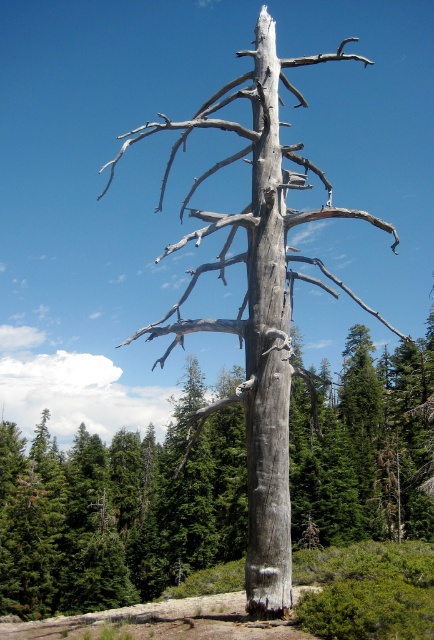
You are an artist trying to sketch the scene. You want to place the gray textured trunk at center in your drawing. Where should you position it on your canvas using the coordinate system provided?

You should position the gray textured trunk at center at the coordinate point of (118, 509) on your canvas.

Based on the photo, you are a hiker trying to identify landmarks in the forest. You see the gray textured trunk at center and the gray rough bark tree trunk at center. Which one is positioned lower in the image?

The gray textured trunk at center is positioned lower than the gray rough bark tree trunk at center.

You are standing in the forest looking at the gray bark tree at center and the gray rough bark tree trunk at center. Which one is positioned to the right side?

The gray bark tree at center is positioned to the right of the gray rough bark tree trunk at center.